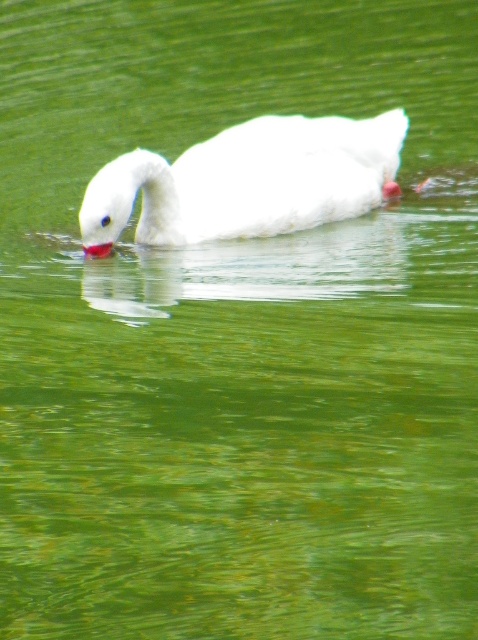
Between white matte swan at center and matte red beak at center, which one has more height?

Result: Standing taller between the two is white matte swan at center.

Looking at this image, can you confirm if white matte swan at center is positioned to the right of matte red beak at center?

Indeed, white matte swan at center is positioned on the right side of matte red beak at center.

Who is more forward, (199,211) or (104,252)?

Positioned in front is point (104,252).

Where is `white matte swan at center`? The image size is (478, 640). white matte swan at center is located at coordinates (249, 180).